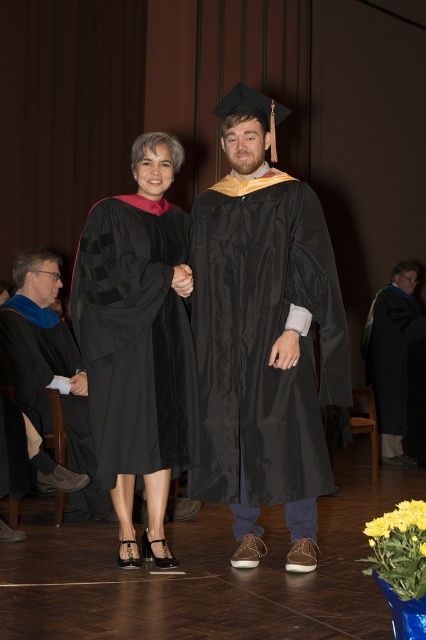
You are a photographer at the graduation ceremony and need to ensure all gowns are visible in the photo. The matte black gown at center and the matte black graduation gown at left are both in your frame. Which gown should you focus on to ensure the smaller one is properly captured?

The matte black gown at center is smaller than the matte black graduation gown at left, so you should focus on the matte black gown at center to ensure its details are properly captured.